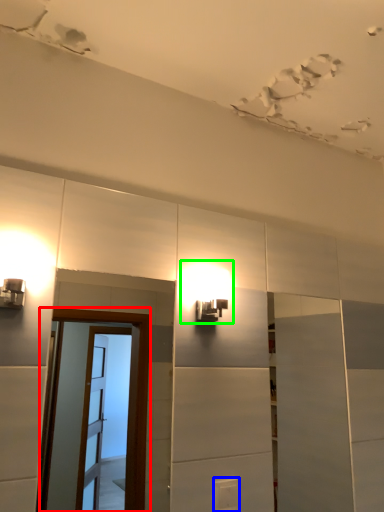
Question: Based on their relative distances, which object is farther from screen door (highlighted by a red box)? Choose from light switch (highlighted by a blue box) and light fixture (highlighted by a green box).

Choices:
 (A) light switch
 (B) light fixture

Answer: (A)